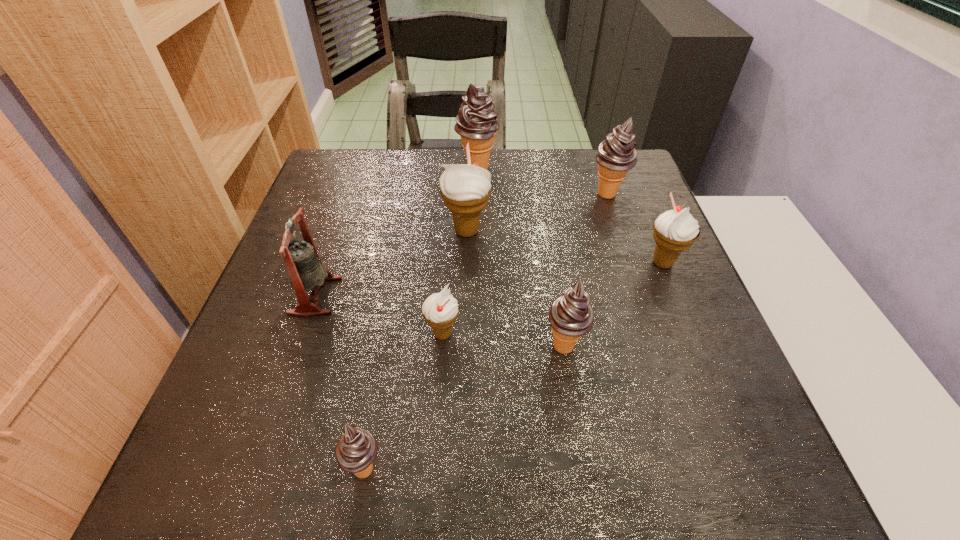
Locate which object ranks third in proximity to the third farthest icecream. Please provide its 2D coordinates. Your answer should be formatted as a tuple, i.e. [(x, y)], where the tuple contains the x and y coordinates of a point satisfying the conditions above.

[(301, 258)]

Identify which icecream is the second closest to the sixth nearest object. Please provide its 2D coordinates. Your answer should be formatted as a tuple, i.e. [(x, y)], where the tuple contains the x and y coordinates of a point satisfying the conditions above.

[(440, 310)]

You are a GUI agent. You are given a task and a screenshot of the screen. Output one action in this format:
    pyautogui.click(x=<x>, y=<y>)
    Task: Click on the icecream that is the fifth closest to the second nearest chocolate icecream
    The image size is (960, 540).
    Given the screenshot: What is the action you would take?
    pyautogui.click(x=617, y=154)

Identify which chocolate icecream is located as the nearest to the rightmost white icecream. Please provide its 2D coordinates. Your answer should be formatted as a tuple, i.e. [(x, y)], where the tuple contains the x and y coordinates of a point satisfying the conditions above.

[(617, 154)]

Locate an element on the screen. The width and height of the screenshot is (960, 540). chocolate icecream that is the closest to the nearest white icecream is located at coordinates (571, 316).

Select which white icecream appears as the closest to the third chocolate icecream from left to right. Please provide its 2D coordinates. Your answer should be formatted as a tuple, i.e. [(x, y)], where the tuple contains the x and y coordinates of a point satisfying the conditions above.

[(440, 310)]

Locate which white icecream ranks second in proximity to the rightmost chocolate icecream. Please provide its 2D coordinates. Your answer should be formatted as a tuple, i.e. [(x, y)], where the tuple contains the x and y coordinates of a point satisfying the conditions above.

[(465, 188)]